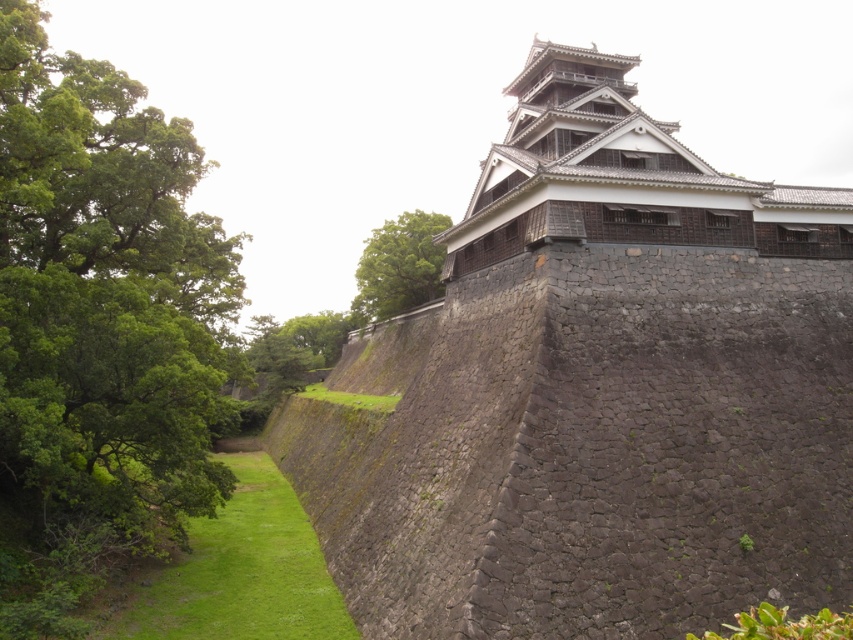
Who is lower down, dark gray stone tower at upper center or green leafy tree at upper center?

dark gray stone tower at upper center is below.

What do you see at coordinates (621, 177) in the screenshot? I see `dark gray stone tower at upper center` at bounding box center [621, 177].

You are a GUI agent. You are given a task and a screenshot of the screen. Output one action in this format:
    pyautogui.click(x=<x>, y=<y>)
    Task: Click on the dark gray stone tower at upper center
    
    Given the screenshot: What is the action you would take?
    pyautogui.click(x=621, y=177)

Can you confirm if green leafy tree at left is shorter than dark gray stone tower at upper center?

In fact, green leafy tree at left may be taller than dark gray stone tower at upper center.

Who is lower down, green leafy tree at left or dark gray stone tower at upper center?

green leafy tree at left

This screenshot has width=853, height=640. I want to click on green leafy tree at left, so click(x=102, y=300).

Locate an element on the screen. The image size is (853, 640). green leafy tree at left is located at coordinates (102, 300).

Does point (50, 179) come in front of point (352, 314)?

Yes, it is in front of point (352, 314).

Does green leafy tree at left appear over green leafy tree at upper center?

Incorrect, green leafy tree at left is not positioned above green leafy tree at upper center.

Is point (91, 368) positioned in front of point (357, 284)?

Yes, it is.

Image resolution: width=853 pixels, height=640 pixels. Find the location of `green leafy tree at left`. green leafy tree at left is located at coordinates (102, 300).